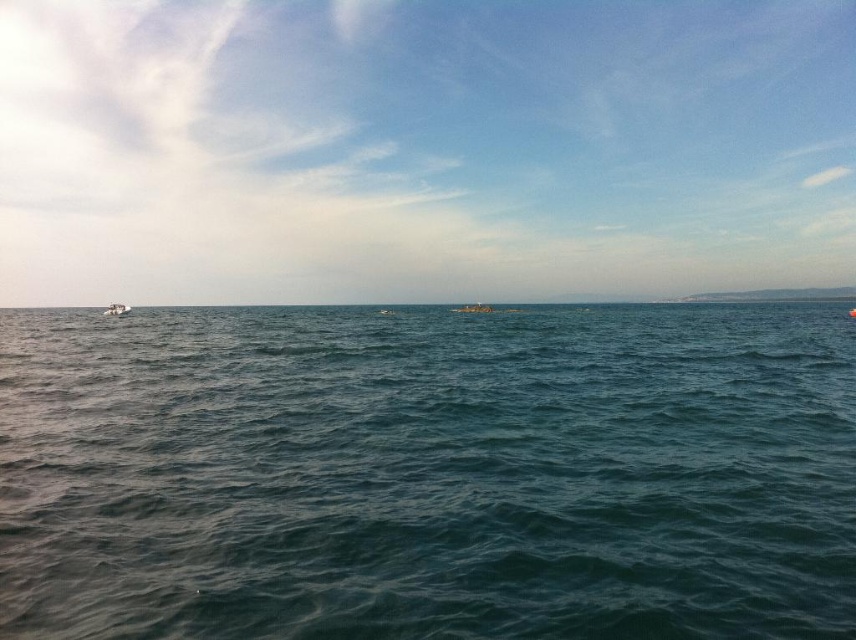
Question: Is greenish-blue water at center positioned before blue water at center?

Choices:
 (A) no
 (B) yes

Answer: (B)

Question: Can you confirm if blue water at center is thinner than white plastic boat at left?

Choices:
 (A) no
 (B) yes

Answer: (A)

Question: Which object is the closest to the white plastic boat at left?

Choices:
 (A) greenish-blue water at center
 (B) blue water at center
 (C) metallic silver boat at center

Answer: (C)

Question: Which point is closer to the camera?

Choices:
 (A) (476, 307)
 (B) (348, 240)
 (C) (476, 456)
 (D) (110, 310)

Answer: (C)

Question: Does metallic silver boat at center have a larger size compared to white plastic boat at left?

Choices:
 (A) yes
 (B) no

Answer: (A)

Question: Which point appears closest to the camera in this image?

Choices:
 (A) (108, 316)
 (B) (501, 467)

Answer: (B)